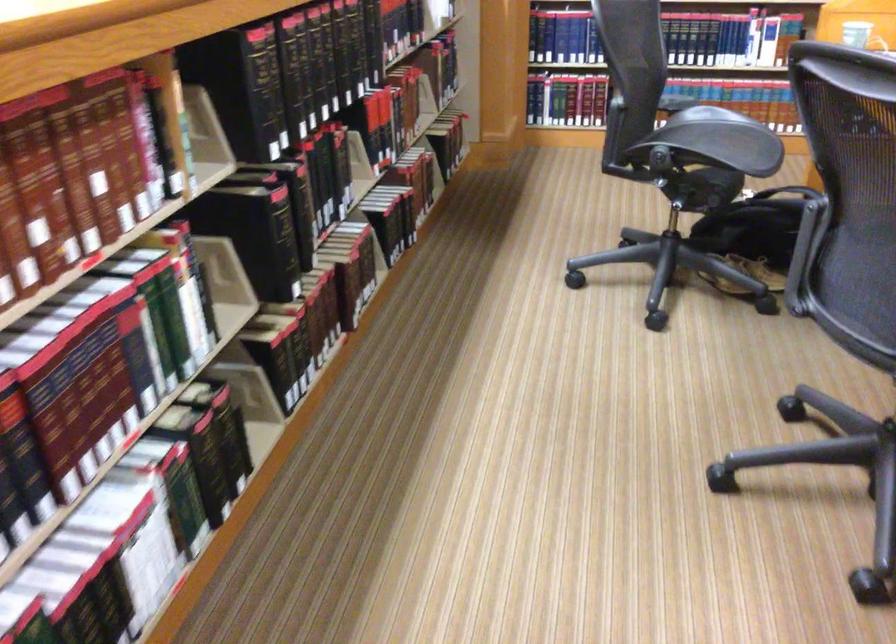
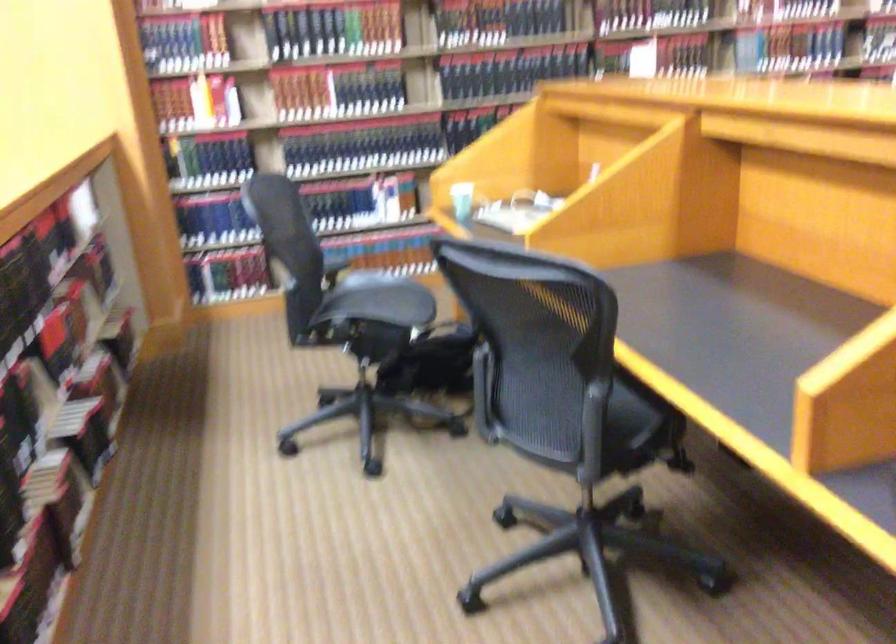
Question: The first image is from the beginning of the video and the second image is from the end. How did the camera likely rotate when shooting the video?

Choices:
 (A) Left
 (B) Right
 (C) Up
 (D) Down

Answer: (B)